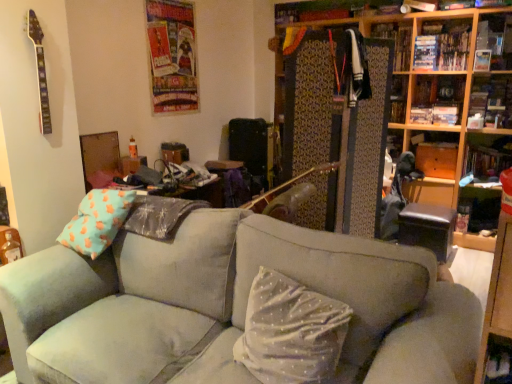
The width and height of the screenshot is (512, 384). Describe the element at coordinates (229, 306) in the screenshot. I see `suede gray couch at center` at that location.

Describe the element at coordinates (440, 92) in the screenshot. This screenshot has height=384, width=512. I see `wooden bookshelf at upper right` at that location.

The width and height of the screenshot is (512, 384). I want to click on wooden bookshelf at right, the fourth shelf in the top-to-bottom sequence, so click(x=486, y=158).

Where is `wooden cabinet at upper right, the 3th shelf when ordered from top to bottom`? The width and height of the screenshot is (512, 384). wooden cabinet at upper right, the 3th shelf when ordered from top to bottom is located at coordinates (435, 153).

Do you think wooden bookshelf at upper right, which appears as the second shelf when viewed from the top, is within wooden bookshelf at right, the fourth shelf in the top-to-bottom sequence, or outside of it?

wooden bookshelf at upper right, which appears as the second shelf when viewed from the top, is outside wooden bookshelf at right, the fourth shelf in the top-to-bottom sequence.

Locate an element on the screen. This screenshot has width=512, height=384. shelf to the right of wooden bookshelf at upper right, which appears as the second shelf when viewed from the top is located at coordinates (486, 158).

From the picture: From a real-world perspective, is suede gray couch at center positioned above or below white dotted fabric pillow at center?

suede gray couch at center is situated lower than white dotted fabric pillow at center in the real world.

From the picture: Which object is wider, suede gray couch at center or white dotted fabric pillow at center?

suede gray couch at center.

Is suede gray couch at center bigger than white dotted fabric pillow at center?

Correct, suede gray couch at center is larger in size than white dotted fabric pillow at center.

Which object is further away from the camera, suede gray couch at center or white dotted fabric pillow at center?

Positioned behind is white dotted fabric pillow at center.

Measure the distance between wooden bookshelf at right, marked as the first shelf in a bottom-to-top arrangement, and wooden bookshelf at upper right, the third shelf positioned from the bottom.

wooden bookshelf at right, marked as the first shelf in a bottom-to-top arrangement, and wooden bookshelf at upper right, the third shelf positioned from the bottom, are 13.22 inches apart.

What's the angular difference between wooden bookshelf at right, the fourth shelf in the top-to-bottom sequence, and wooden bookshelf at upper right, the third shelf positioned from the bottom,'s facing directions?

The angle between the facing direction of wooden bookshelf at right, the fourth shelf in the top-to-bottom sequence, and the facing direction of wooden bookshelf at upper right, the third shelf positioned from the bottom, is 0.329 degrees.

Is wooden bookshelf at right, the fourth shelf in the top-to-bottom sequence, wider or thinner than wooden bookshelf at upper right, which appears as the second shelf when viewed from the top?

Considering their sizes, wooden bookshelf at right, the fourth shelf in the top-to-bottom sequence, looks broader than wooden bookshelf at upper right, which appears as the second shelf when viewed from the top.

Between wooden bookshelf at right, marked as the first shelf in a bottom-to-top arrangement, and wooden bookshelf at upper right, which appears as the second shelf when viewed from the top, which one is positioned in front?

Positioned in front is wooden bookshelf at upper right, which appears as the second shelf when viewed from the top.

Does white dotted fabric pillow at center have a lesser height compared to wooden cabinet at upper right, the second shelf when ordered from bottom to top?

No.

Where is `pillow that appears in front of the wooden cabinet at upper right, the 3th shelf when ordered from top to bottom`? This screenshot has height=384, width=512. pillow that appears in front of the wooden cabinet at upper right, the 3th shelf when ordered from top to bottom is located at coordinates (291, 332).

From the image's perspective, is white dotted fabric pillow at center located above or below wooden cabinet at upper right, the second shelf when ordered from bottom to top?

From the image's perspective, white dotted fabric pillow at center appears below wooden cabinet at upper right, the second shelf when ordered from bottom to top.

From a real-world perspective, between wooden bookshelf at upper right, the first shelf in the top-to-bottom sequence, and hardcover book at upper right, who is vertically lower?

From a 3D spatial view, wooden bookshelf at upper right, the first shelf in the top-to-bottom sequence, is below.

Is wooden bookshelf at upper right, positioned as the fourth shelf in bottom-to-top order, to the right of hardcover book at upper right from the viewer's perspective?

Correct, you'll find wooden bookshelf at upper right, positioned as the fourth shelf in bottom-to-top order, to the right of hardcover book at upper right.

Is wooden bookshelf at right, marked as the first shelf in a bottom-to-top arrangement, inside or outside of suede gray couch at center?

wooden bookshelf at right, marked as the first shelf in a bottom-to-top arrangement, cannot be found inside suede gray couch at center.

Can you confirm if wooden bookshelf at right, marked as the first shelf in a bottom-to-top arrangement, is positioned to the right of suede gray couch at center?

Indeed, wooden bookshelf at right, marked as the first shelf in a bottom-to-top arrangement, is positioned on the right side of suede gray couch at center.

Identify the location of studio couch lying in front of the wooden bookshelf at right, marked as the first shelf in a bottom-to-top arrangement. The image size is (512, 384). (229, 306).

From the picture: Between wooden bookshelf at right, the fourth shelf in the top-to-bottom sequence, and suede gray couch at center, which one has smaller size?

wooden bookshelf at right, the fourth shelf in the top-to-bottom sequence.

From the picture: Is wooden bookshelf at right, marked as the first shelf in a bottom-to-top arrangement, beside white dotted fabric pillow at center?

wooden bookshelf at right, marked as the first shelf in a bottom-to-top arrangement, and white dotted fabric pillow at center are not in contact.

Which object is wider, wooden bookshelf at right, the fourth shelf in the top-to-bottom sequence, or white dotted fabric pillow at center?

With larger width is wooden bookshelf at right, the fourth shelf in the top-to-bottom sequence.

Is white dotted fabric pillow at center at the back of wooden bookshelf at right, marked as the first shelf in a bottom-to-top arrangement?

wooden bookshelf at right, marked as the first shelf in a bottom-to-top arrangement, is not turned away from white dotted fabric pillow at center.

From a real-world perspective, count 2nd shelfs downward from the wooden bookshelf at upper right, the third shelf positioned from the bottom, and point to it. Please provide its 2D coordinates.

[(486, 158)]

Find the location of a particular element. The height and width of the screenshot is (384, 512). studio couch to the left of white dotted fabric pillow at center is located at coordinates (229, 306).

When comparing their distances from suede gray couch at center, does wooden bookshelf at upper right, the third shelf positioned from the bottom, or hardcover book at upper right seem further?

Among the two, hardcover book at upper right is located further to suede gray couch at center.

Looking at the image, which one is located closer to white dotted fabric pillow at center, wooden bookshelf at upper right or wooden cabinet at upper right, the second shelf when ordered from bottom to top?

The object closer to white dotted fabric pillow at center is wooden bookshelf at upper right.

Considering their positions, is wooden bookshelf at upper right, which appears as the second shelf when viewed from the top, positioned closer to wooden bookshelf at upper right than suede gray couch at center?

wooden bookshelf at upper right, which appears as the second shelf when viewed from the top, is positioned closer to the anchor wooden bookshelf at upper right.

Estimate the real-world distances between objects in this image. Which object is further from hardcover book at upper right, wooden bookshelf at upper right or wooden bookshelf at upper right, the third shelf positioned from the bottom?

wooden bookshelf at upper right, the third shelf positioned from the bottom, lies further to hardcover book at upper right than the other object.

Which object lies further to the anchor point wooden cabinet at upper right, the second shelf when ordered from bottom to top, wooden bookshelf at upper right, which appears as the second shelf when viewed from the top, or hardcover book at upper right?

hardcover book at upper right.

Looking at this image, looking at the image, which one is located closer to wooden cabinet at upper right, the 3th shelf when ordered from top to bottom, hardcover book at upper right or wooden bookshelf at upper right?

wooden bookshelf at upper right is closer to wooden cabinet at upper right, the 3th shelf when ordered from top to bottom.

Which object lies further to the anchor point suede gray couch at center, wooden bookshelf at upper right or white dotted fabric pillow at center?

The object further to suede gray couch at center is wooden bookshelf at upper right.

When comparing their distances from wooden cabinet at upper right, the 3th shelf when ordered from top to bottom, does wooden bookshelf at right, the fourth shelf in the top-to-bottom sequence, or wooden bookshelf at upper right, positioned as the fourth shelf in bottom-to-top order, seem closer?

wooden bookshelf at right, the fourth shelf in the top-to-bottom sequence.

You are a GUI agent. You are given a task and a screenshot of the screen. Output one action in this format:
    pyautogui.click(x=<x>, y=<y>)
    Task: Click on the bookcase between suede gray couch at center and wooden bookshelf at upper right, the first shelf in the top-to-bottom sequence, in the front-back direction
    The width and height of the screenshot is (512, 384).
    Given the screenshot: What is the action you would take?
    pyautogui.click(x=440, y=92)

At what (x,y) coordinates should I click in order to perform the action: click on shelf between white dotted fabric pillow at center and wooden bookshelf at right, the fourth shelf in the top-to-bottom sequence, in the front-back direction. Please return your answer as a coordinate pair (x, y). The height and width of the screenshot is (384, 512). Looking at the image, I should click on (490, 102).

At what (x,y) coordinates should I click in order to perform the action: click on pillow between suede gray couch at center and wooden bookshelf at upper right, positioned as the fourth shelf in bottom-to-top order, in the front-back direction. Please return your answer as a coordinate pair (x, y). Looking at the image, I should click on (291, 332).

Locate an element on the screen. book between suede gray couch at center and wooden bookshelf at upper right, positioned as the fourth shelf in bottom-to-top order, in the front-back direction is located at coordinates (442, 47).